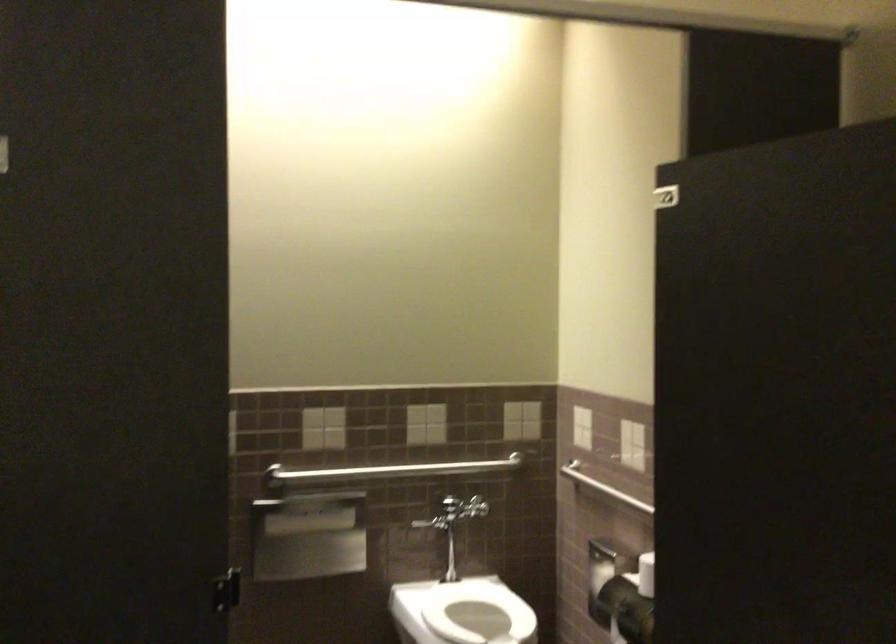
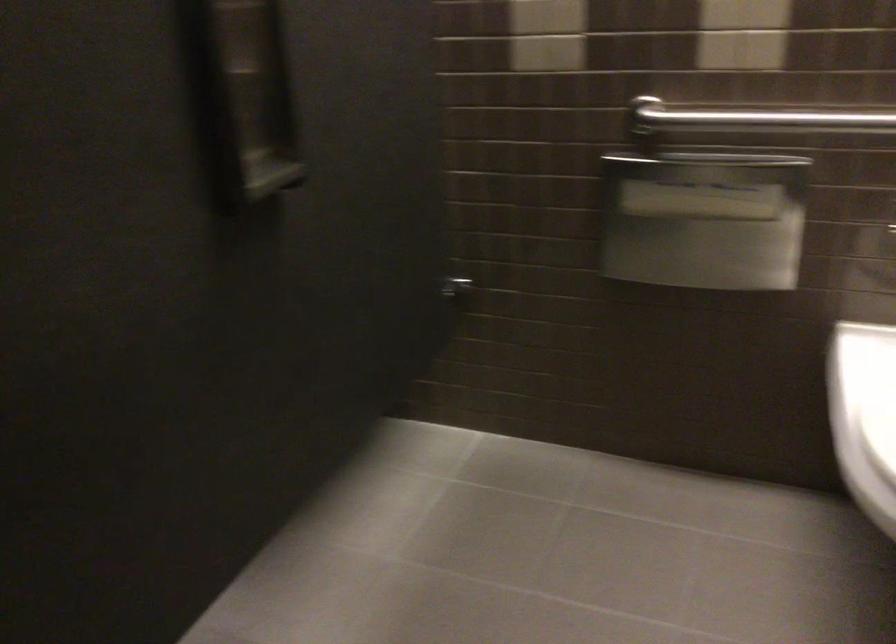
Find the pixel in the second image that matches (312,532) in the first image.

(703, 220)